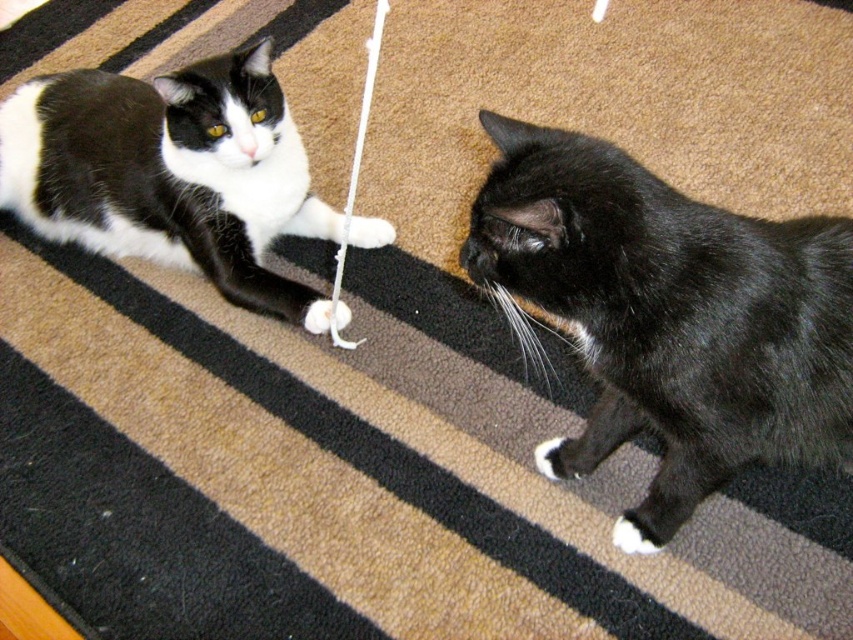
What do you see at coordinates (670, 316) in the screenshot?
I see `black fur cat at center` at bounding box center [670, 316].

Measure the distance between point (757, 352) and camera.

Point (757, 352) is 3.32 feet from camera.

Between point (747, 236) and point (218, 108), which one is positioned behind?

Positioned behind is point (218, 108).

This screenshot has width=853, height=640. In order to click on black fur cat at center in this screenshot , I will do `click(670, 316)`.

Can you confirm if black fur cat at center is positioned above white fuzzy string at center?

Actually, black fur cat at center is below white fuzzy string at center.

Is black fur cat at center further to camera compared to white fuzzy string at center?

No, black fur cat at center is in front of white fuzzy string at center.

Is point (733, 227) farther from viewer compared to point (352, 154)?

No, it is not.

Find the location of `black fur cat at center`. black fur cat at center is located at coordinates (670, 316).

Is black matte fur cat at upper left shorter than white fuzzy string at center?

Yes, black matte fur cat at upper left is shorter than white fuzzy string at center.

Does black matte fur cat at upper left have a greater width compared to white fuzzy string at center?

Yes.

What do you see at coordinates (171, 173) in the screenshot? I see `black matte fur cat at upper left` at bounding box center [171, 173].

The image size is (853, 640). I want to click on black matte fur cat at upper left, so click(171, 173).